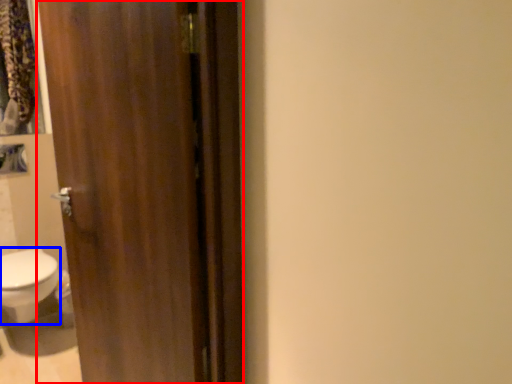
Question: Which point is further to the camera, door (highlighted by a red box) or bidet (highlighted by a blue box)?

Choices:
 (A) door
 (B) bidet

Answer: (B)